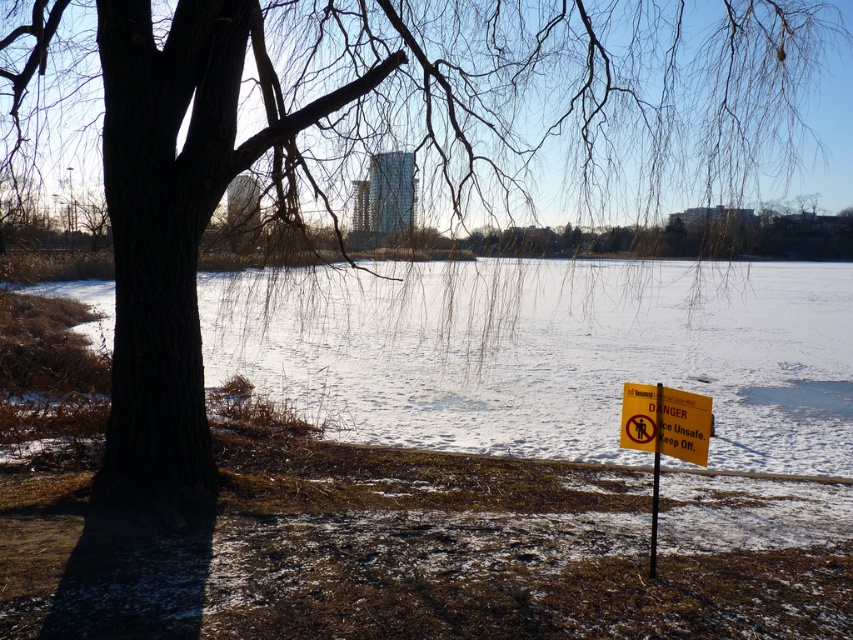
Between point (519, 273) and point (653, 570), which one is positioned in front?

Positioned in front is point (653, 570).

Is point (343, 390) closer to camera compared to point (660, 436)?

No, (343, 390) is further to viewer.

Locate an element on the screen. white frozen water at center is located at coordinates (548, 353).

Does yellow paper sign at lower center appear over yellow plastic sign at lower right?

Yes.

Does point (685, 458) come in front of point (654, 451)?

That is True.

Between point (643, 433) and point (654, 436), which one is positioned in front?

Point (654, 436)

In order to click on yellow paper sign at lower center in this screenshot , I will do `click(664, 432)`.

Consider the image. Is yellow paper sign at lower right positioned at the back of yellow plastic sign at lower right?

No, it is in front of yellow plastic sign at lower right.

Consider the image. Which is below, yellow paper sign at lower right or yellow plastic sign at lower right?

Positioned lower is yellow plastic sign at lower right.

Describe the element at coordinates (665, 420) in the screenshot. I see `yellow paper sign at lower right` at that location.

Find the location of `yellow paper sign at lower right`. yellow paper sign at lower right is located at coordinates (665, 420).